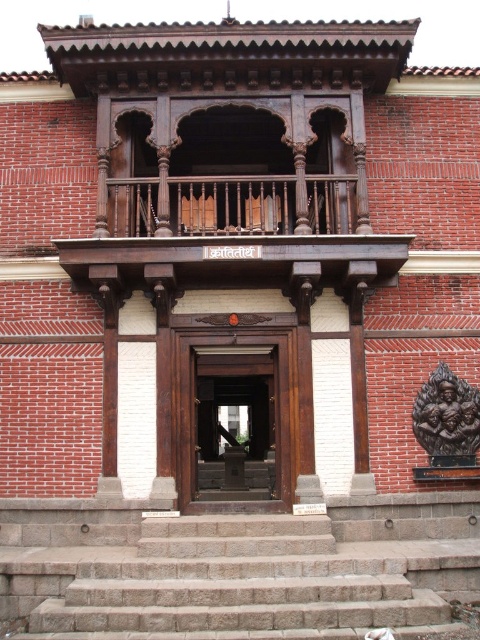
You are a delivery person with a cart that is 2 meters wide. You need to move your cart from the street to the entrance. The path between the dark wood door at center and the polished wood railing at upper center is the only route available. Can your cart fit through this path?

The distance between the dark wood door at center and the polished wood railing at upper center is 4.80 meters. Since your cart is only 2 meters wide, it can easily fit through the 4.80 meter gap between them.

You are standing at the entrance of the traditional South Asian building and want to go up the brown stone stairs at lower center. From your current position, in which direction should you move to reach the stairs?

The brown stone stairs at lower center are located at point 0.894 on the horizontal axis and 0.498 on the vertical axis. Since you are at the entrance, you should move towards the lower center direction to reach the stairs.